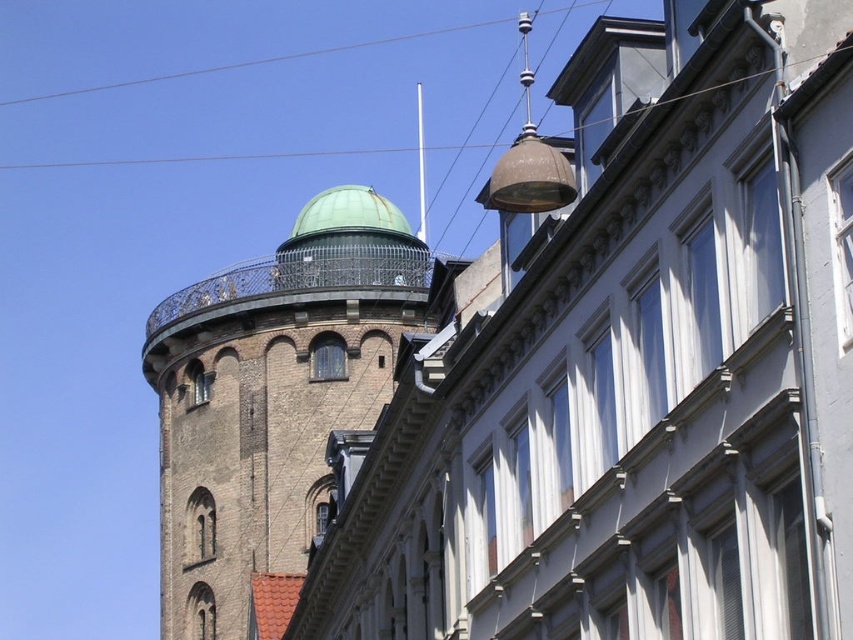
Can you confirm if green copper dome at upper left is smaller than clear wire at upper center?

No, green copper dome at upper left is not smaller than clear wire at upper center.

Can you confirm if green copper dome at upper left is wider than clear wire at upper center?

In fact, green copper dome at upper left might be narrower than clear wire at upper center.

Locate an element on the screen. green copper dome at upper left is located at coordinates (271, 397).

This screenshot has height=640, width=853. Find the location of `green copper dome at upper left`. green copper dome at upper left is located at coordinates (271, 397).

Does point (318, 216) come closer to viewer compared to point (245, 61)?

Yes, point (318, 216) is in front of point (245, 61).

Is green copper dome at upper center to the right of clear wire at upper center from the viewer's perspective?

Yes, green copper dome at upper center is to the right of clear wire at upper center.

Where is `green copper dome at upper center`? The width and height of the screenshot is (853, 640). green copper dome at upper center is located at coordinates (349, 212).

Who is positioned more to the left, green copper dome at upper left or green copper dome at upper center?

From the viewer's perspective, green copper dome at upper left appears more on the left side.

Does green copper dome at upper left have a lesser height compared to green copper dome at upper center?

Incorrect, green copper dome at upper left's height does not fall short of green copper dome at upper center's.

Find the location of a particular element. green copper dome at upper left is located at coordinates (271, 397).